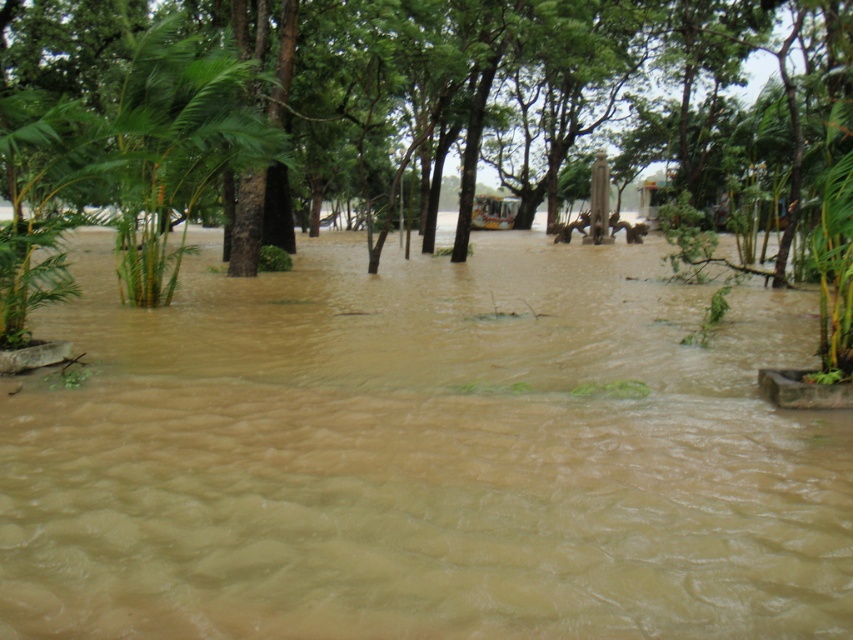
Question: In this image, where is brown wood tree at center located relative to green leafy palm tree at left?

Choices:
 (A) right
 (B) left

Answer: (A)

Question: Which object appears farthest from the camera in this image?

Choices:
 (A) brown wood tree at center
 (B) brown muddy water at center

Answer: (A)

Question: Based on their relative distances, which object is nearer to the green leafy palm tree at left?

Choices:
 (A) brown wood tree at center
 (B) brown muddy water at center

Answer: (B)

Question: Does brown wood tree at center lie in front of green leafy palm tree at left?

Choices:
 (A) yes
 (B) no

Answer: (A)

Question: Observing the image, what is the correct spatial positioning of brown muddy water at center in reference to green leafy palm tree at left?

Choices:
 (A) right
 (B) left

Answer: (A)

Question: Among these points, which one is nearest to the camera?

Choices:
 (A) (367, 612)
 (B) (123, 204)

Answer: (A)